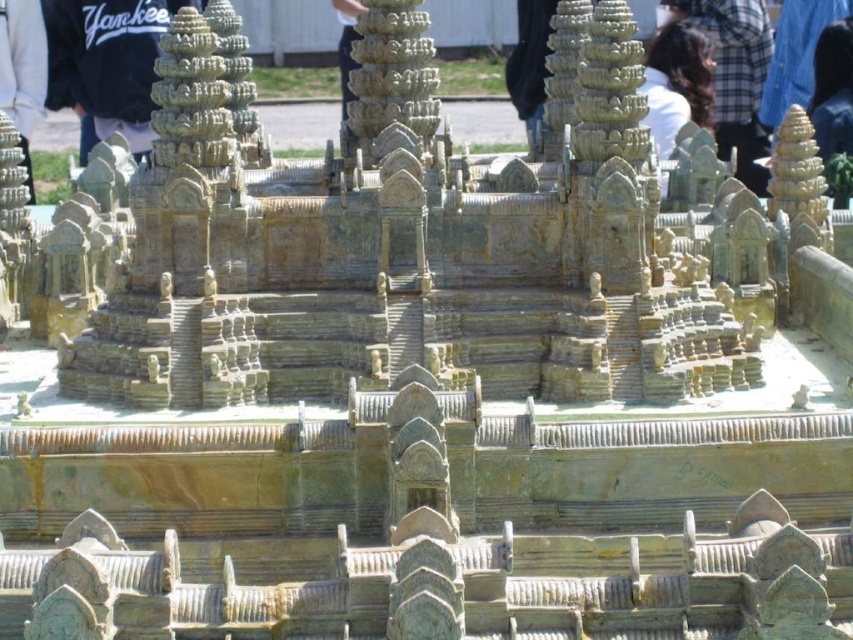
Question: Is black cotton hoodie at upper left thinner than brown hair at upper center?

Choices:
 (A) yes
 (B) no

Answer: (B)

Question: Which point is farther from the camera taking this photo?

Choices:
 (A) (682, 44)
 (B) (51, 102)

Answer: (B)

Question: Does black cotton hoodie at upper left have a greater width compared to brown hair at upper center?

Choices:
 (A) yes
 (B) no

Answer: (A)

Question: Which point is closer to the camera?

Choices:
 (A) brown hair at upper center
 (B) black cotton hoodie at upper left

Answer: (A)

Question: Can you confirm if black cotton hoodie at upper left is positioned below brown hair at upper center?

Choices:
 (A) no
 (B) yes

Answer: (A)

Question: Which point is closer to the camera?

Choices:
 (A) brown hair at upper center
 (B) black cotton hoodie at upper left

Answer: (A)